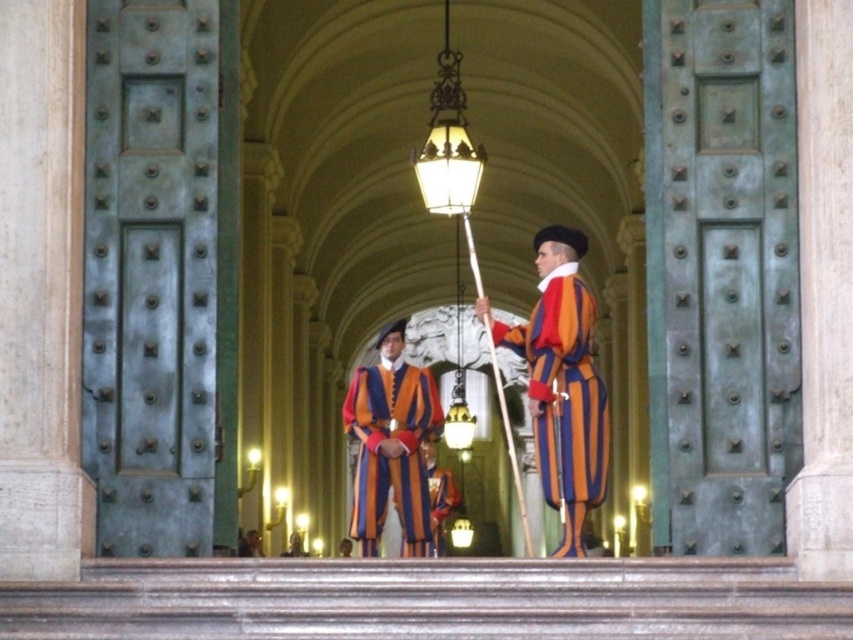
Question: Which point is closer to the camera?

Choices:
 (A) (570, 384)
 (B) (431, 468)

Answer: (A)

Question: Can you confirm if orange striped fabric at center is positioned below orange striped uniform at center?

Choices:
 (A) no
 (B) yes

Answer: (A)

Question: Does striped velvet uniform at center lie in front of orange striped uniform at center?

Choices:
 (A) no
 (B) yes

Answer: (B)

Question: Which of these objects is positioned farthest from the orange striped uniform at center?

Choices:
 (A) striped velvet uniform at center
 (B) orange striped fabric at center

Answer: (B)

Question: Which is farther from the striped velvet uniform at center?

Choices:
 (A) orange striped fabric at center
 (B) orange striped uniform at center

Answer: (B)

Question: Is orange striped fabric at center thinner than orange striped uniform at center?

Choices:
 (A) no
 (B) yes

Answer: (A)